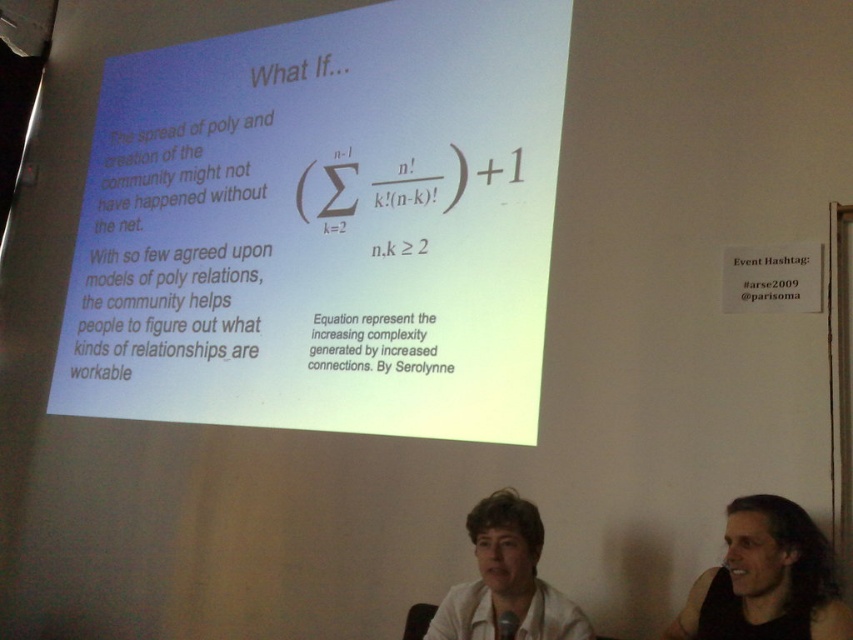
Is black hair at lower right positioned in front of white matte shirt at center?

That is True.

Does point (728, 618) come farther from viewer compared to point (451, 593)?

No, it is in front of (451, 593).

Find the location of a particular element. black hair at lower right is located at coordinates (767, 577).

Where is `black hair at lower right`? The width and height of the screenshot is (853, 640). black hair at lower right is located at coordinates (767, 577).

Does white paper at center appear over white matte shirt at center?

Indeed, white paper at center is positioned over white matte shirt at center.

Which of these two, white paper at center or white matte shirt at center, stands shorter?

white matte shirt at center is shorter.

Who is more forward, (x=532, y=68) or (x=509, y=545)?

Point (x=509, y=545) is in front.

The width and height of the screenshot is (853, 640). Find the location of `white paper at center`. white paper at center is located at coordinates (323, 225).

Is point (508, 374) farther from camera compared to point (705, 628)?

Yes, point (508, 374) is farther from viewer.

Which of these two, white paper at center or black hair at lower right, stands taller?

white paper at center is taller.

The image size is (853, 640). What do you see at coordinates (323, 225) in the screenshot? I see `white paper at center` at bounding box center [323, 225].

At what (x,y) coordinates should I click in order to perform the action: click on white paper at center. Please return your answer as a coordinate pair (x, y). This screenshot has height=640, width=853. Looking at the image, I should click on (323, 225).